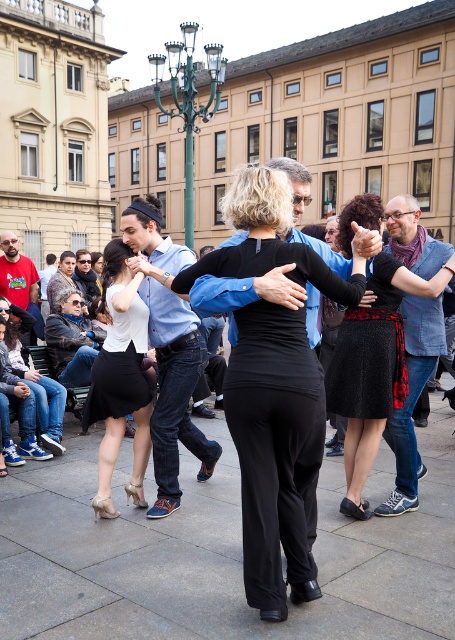
Question: Which of the following is the closest to the observer?

Choices:
 (A) black textured skirt at center
 (B) red cotton t-shirt at lower left
 (C) black matte pants at center

Answer: (C)

Question: Does black matte pants at center have a smaller size compared to matte white blouse at center?

Choices:
 (A) yes
 (B) no

Answer: (B)

Question: Among these points, which one is nearest to the camera?

Choices:
 (A) (85, 294)
 (B) (100, 449)
 (C) (10, 294)

Answer: (B)

Question: Which object is closer to the camera taking this photo?

Choices:
 (A) black textured skirt at center
 (B) red cotton t-shirt at lower left
 (C) matte blue shirt at center

Answer: (A)

Question: Is black textured skirt at center wider than matte blue shirt at center?

Choices:
 (A) no
 (B) yes

Answer: (B)

Question: Does black matte pants at center appear under black glittery dress at center?

Choices:
 (A) no
 (B) yes

Answer: (B)